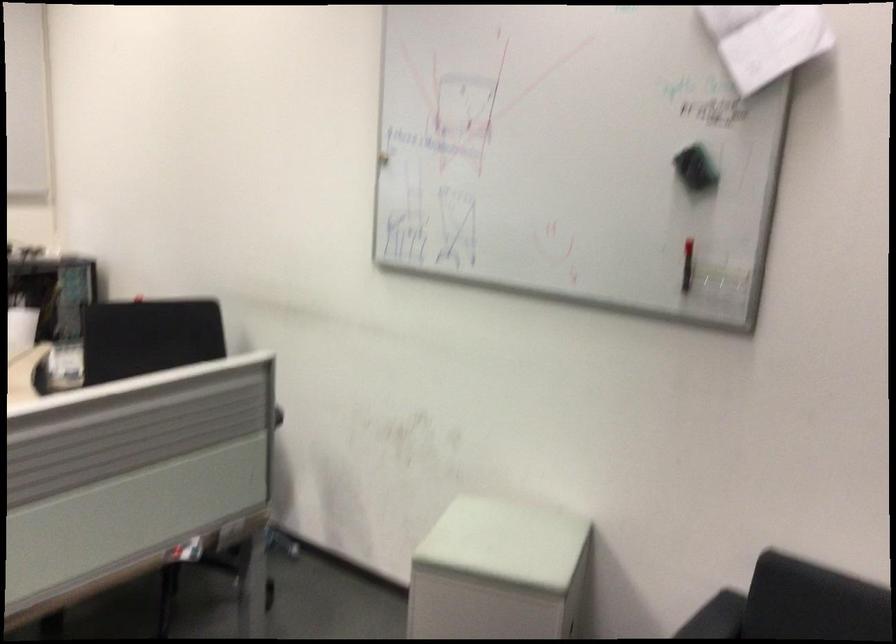
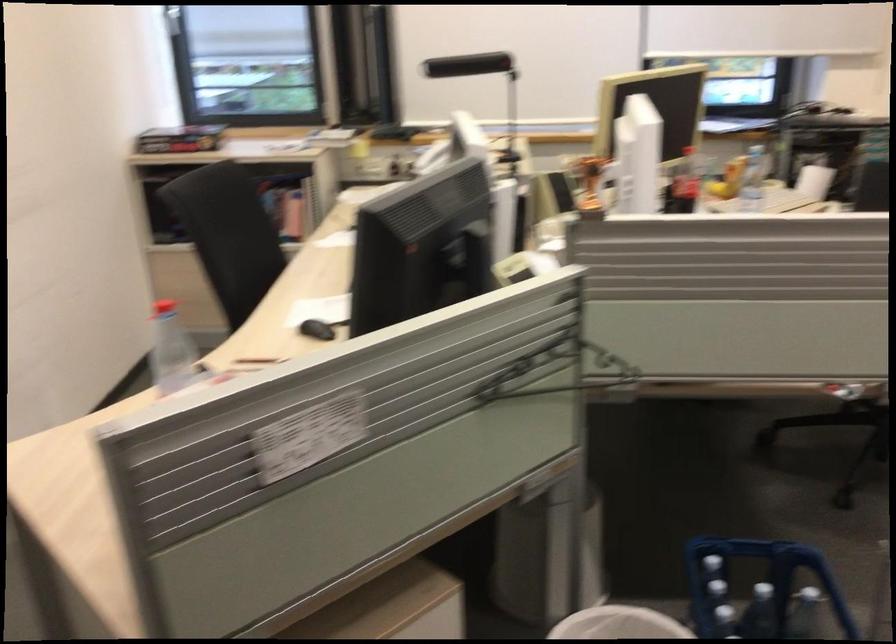
Question: The images are taken continuously from a first-person perspective. In which direction is your viewpoint rotating?

Choices:
 (A) Left
 (B) Right
 (C) Up
 (D) Down

Answer: (A)